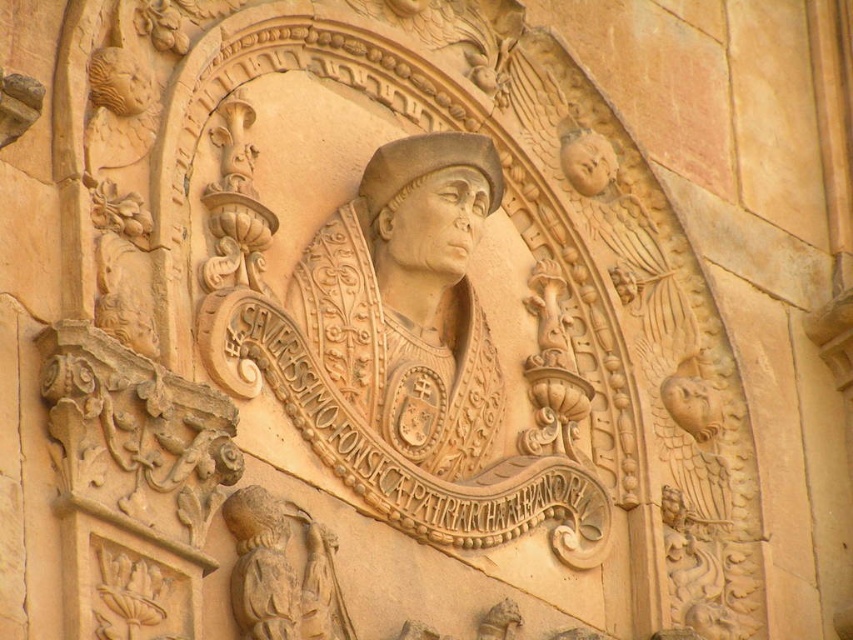
Question: Does matte stone head at center have a larger size compared to matte stone head at upper right?

Choices:
 (A) yes
 (B) no

Answer: (A)

Question: Which object is closer to the camera taking this photo?

Choices:
 (A) beige stone head at lower left
 (B) matte stone head at center
 (C) matte stone head at upper right

Answer: (A)

Question: Which object is the closest to the beige stone head at lower left?

Choices:
 (A) matte stone head at upper right
 (B) matte stone head at center

Answer: (B)

Question: Which is nearer to the matte stone head at center?

Choices:
 (A) beige stone head at lower left
 (B) matte stone head at upper right

Answer: (B)

Question: Does beige stone head at lower left appear under matte stone head at upper right?

Choices:
 (A) no
 (B) yes

Answer: (B)

Question: Does beige stone head at lower left appear on the right side of matte stone head at upper right?

Choices:
 (A) yes
 (B) no

Answer: (B)